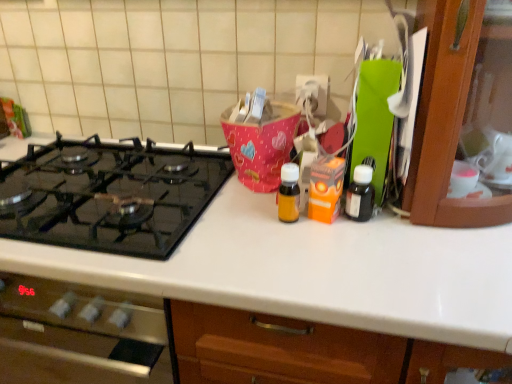
Question: Can you confirm if black glass gas stove at left is taller than translucent amber bottle at center, the second bottle positioned from the right?

Choices:
 (A) no
 (B) yes

Answer: (A)

Question: Does black glass gas stove at left have a greater width compared to translucent amber bottle at center, the second bottle positioned from the right?

Choices:
 (A) no
 (B) yes

Answer: (B)

Question: From the image's perspective, would you say black glass gas stove at left is positioned over translucent amber bottle at center, acting as the 1th bottle starting from the left?

Choices:
 (A) yes
 (B) no

Answer: (A)

Question: Is black glass gas stove at left smaller than translucent amber bottle at center, the second bottle positioned from the right?

Choices:
 (A) yes
 (B) no

Answer: (B)

Question: Is black glass gas stove at left at the right side of translucent amber bottle at center, the second bottle positioned from the right?

Choices:
 (A) no
 (B) yes

Answer: (A)

Question: Does black glass gas stove at left turn towards translucent amber bottle at center, the second bottle positioned from the right?

Choices:
 (A) no
 (B) yes

Answer: (A)

Question: Can you confirm if black matte bottle at right, which ranks as the first bottle in right-to-left order, is smaller than translucent amber bottle at center, the second bottle positioned from the right?

Choices:
 (A) yes
 (B) no

Answer: (B)

Question: From a real-world perspective, is black matte bottle at right, which ranks as the first bottle in right-to-left order, on translucent amber bottle at center, acting as the 1th bottle starting from the left?

Choices:
 (A) no
 (B) yes

Answer: (A)

Question: Is black matte bottle at right, which is the second bottle from left to right, oriented away from translucent amber bottle at center, acting as the 1th bottle starting from the left?

Choices:
 (A) yes
 (B) no

Answer: (B)

Question: Can we say black matte bottle at right, which ranks as the first bottle in right-to-left order, lies outside translucent amber bottle at center, acting as the 1th bottle starting from the left?

Choices:
 (A) yes
 (B) no

Answer: (A)

Question: From the image's perspective, is black matte bottle at right, which ranks as the first bottle in right-to-left order, under translucent amber bottle at center, the second bottle positioned from the right?

Choices:
 (A) yes
 (B) no

Answer: (A)

Question: Does black matte bottle at right, which ranks as the first bottle in right-to-left order, lie behind translucent amber bottle at center, the second bottle positioned from the right?

Choices:
 (A) no
 (B) yes

Answer: (B)

Question: Considering the relative sizes of black matte bottle at right, which ranks as the first bottle in right-to-left order, and black glass gas stove at left in the image provided, is black matte bottle at right, which ranks as the first bottle in right-to-left order, wider than black glass gas stove at left?

Choices:
 (A) yes
 (B) no

Answer: (B)